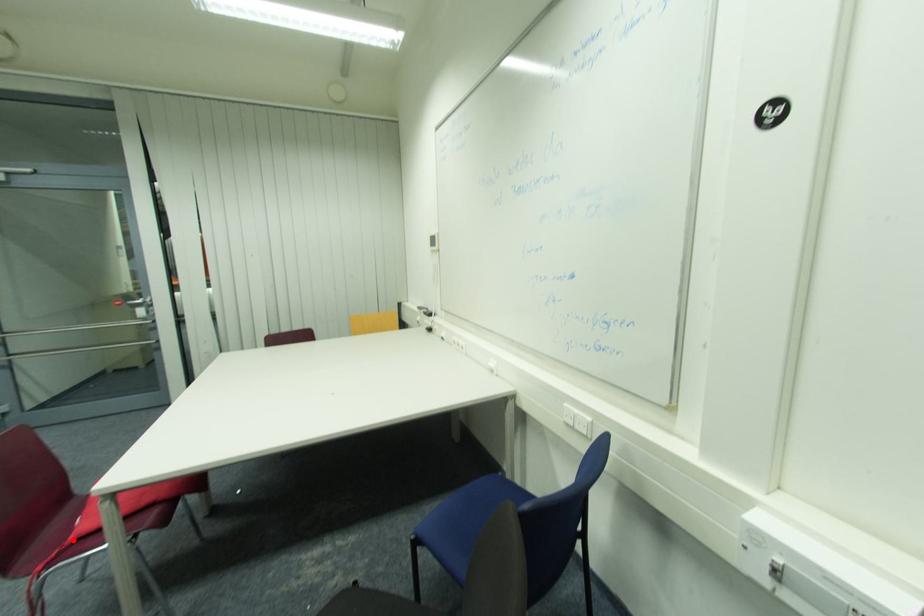
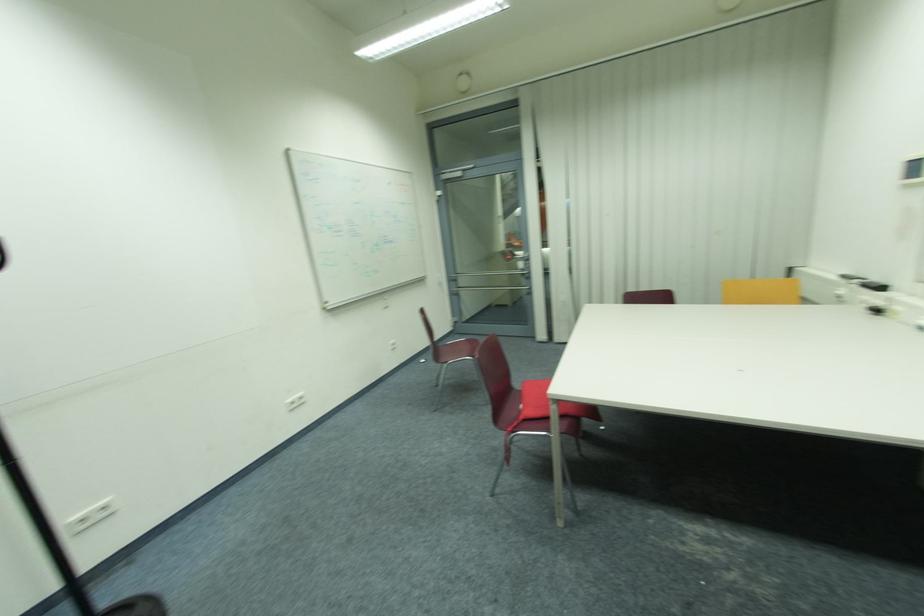
Where in the second image is the point corresponding to the highlighted location from the first image?

(527, 418)